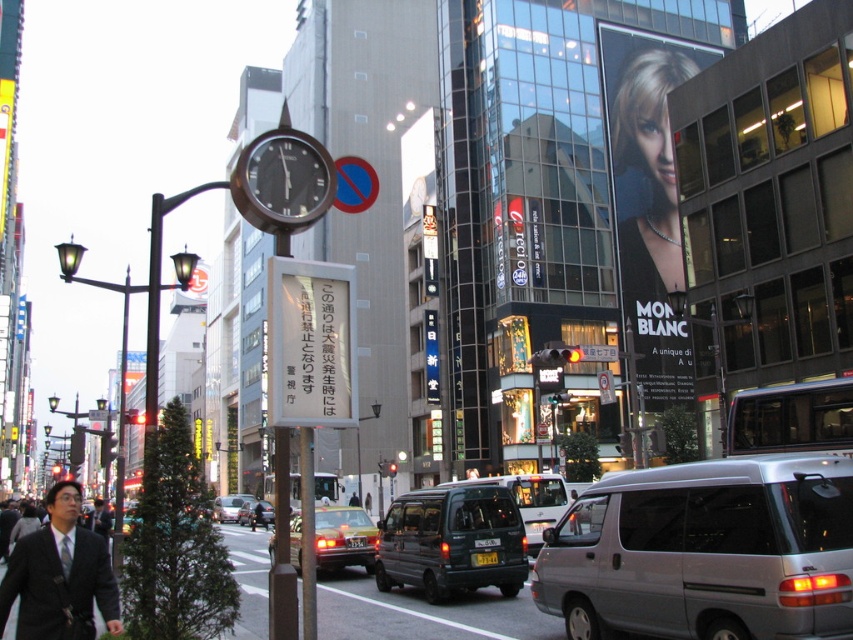
In the scene shown: Does dark gray suit at lower left appear on the left side of metallic silver van at center?

In fact, dark gray suit at lower left is to the right of metallic silver van at center.

Does point (91, 611) come closer to viewer compared to point (271, 508)?

Yes, it is in front of point (271, 508).

Locate an element on the screen. dark gray suit at lower left is located at coordinates (61, 576).

Is metallic green van at center taller than yellow metallic taxi at center?

In fact, metallic green van at center may be shorter than yellow metallic taxi at center.

Is metallic green van at center bigger than yellow metallic taxi at center?

Incorrect, metallic green van at center is not larger than yellow metallic taxi at center.

This screenshot has width=853, height=640. What are the coordinates of `metallic green van at center` in the screenshot? It's located at (451, 541).

Between point (502, 548) and point (352, 353), which one is positioned in front?

Point (352, 353)

Which is behind, point (381, 532) or point (321, 291)?

Positioned behind is point (381, 532).

The height and width of the screenshot is (640, 853). I want to click on metallic green van at center, so click(451, 541).